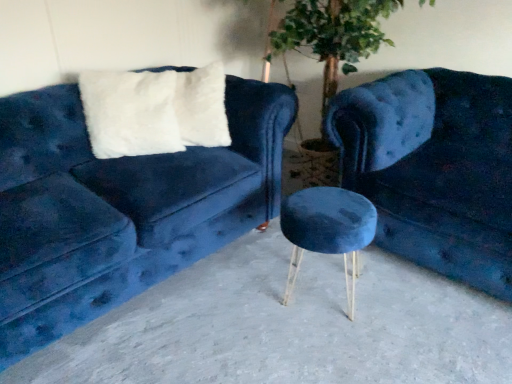
Locate an element on the screen. vacant area that lies between velvet blue couch at left, marked as the 2th studio couch in a right-to-left arrangement, and velvet blue stool at center is located at coordinates (210, 324).